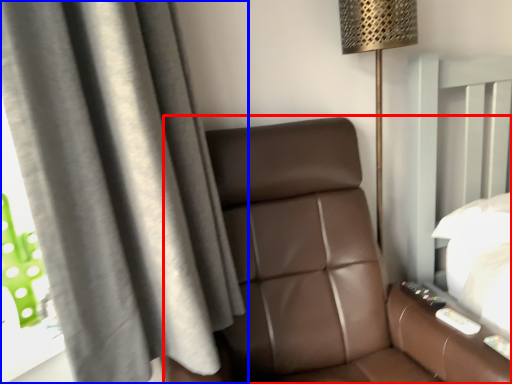
Question: Which object is closer to the camera taking this photo, furniture (highlighted by a red box) or curtain (highlighted by a blue box)?

Choices:
 (A) furniture
 (B) curtain

Answer: (A)